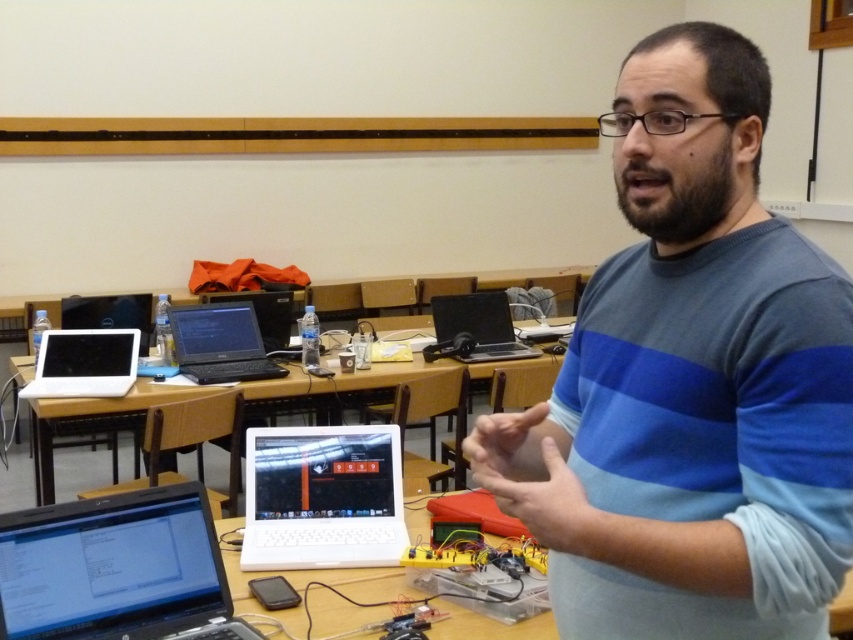
You are a student in the classroom and you want to locate the point with coordinates (115, 570). Which object should you look for?

The point with coordinates (115, 570) is located on the silver metallic laptop at lower left.

You are organizing a workshop and need to place a large poster on the white plastic table at center. Considering the black matte laptop at center is already placed there, can the poster fit on the table without overlapping the laptop?

The white plastic table at center is wider than the black matte laptop at center, so the poster can fit on the table without overlapping the laptop as long as it is positioned appropriately.